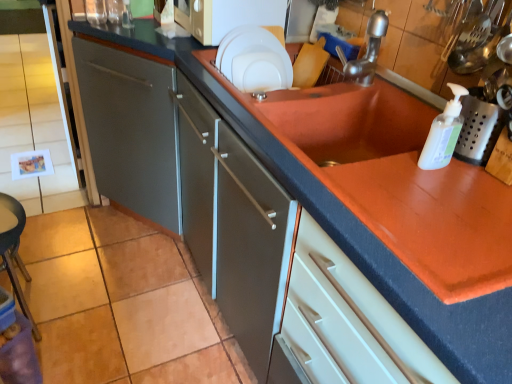
Question: Would you say white plastic soap dispenser at upper right is to the left or to the right of white matte microwave at upper center in the picture?

Choices:
 (A) left
 (B) right

Answer: (B)

Question: In terms of height, does white plastic soap dispenser at upper right look taller or shorter compared to white matte microwave at upper center?

Choices:
 (A) short
 (B) tall

Answer: (B)

Question: Which object is positioned closest to the silver metallic faucet at upper right?

Choices:
 (A) white glossy plate at upper center
 (B) white plastic soap dispenser at upper right
 (C) white matte microwave at upper center

Answer: (A)

Question: Estimate the real-world distances between objects in this image. Which object is closer to the white matte microwave at upper center?

Choices:
 (A) white plastic soap dispenser at upper right
 (B) silver metallic faucet at upper right
 (C) white glossy plate at upper center

Answer: (C)